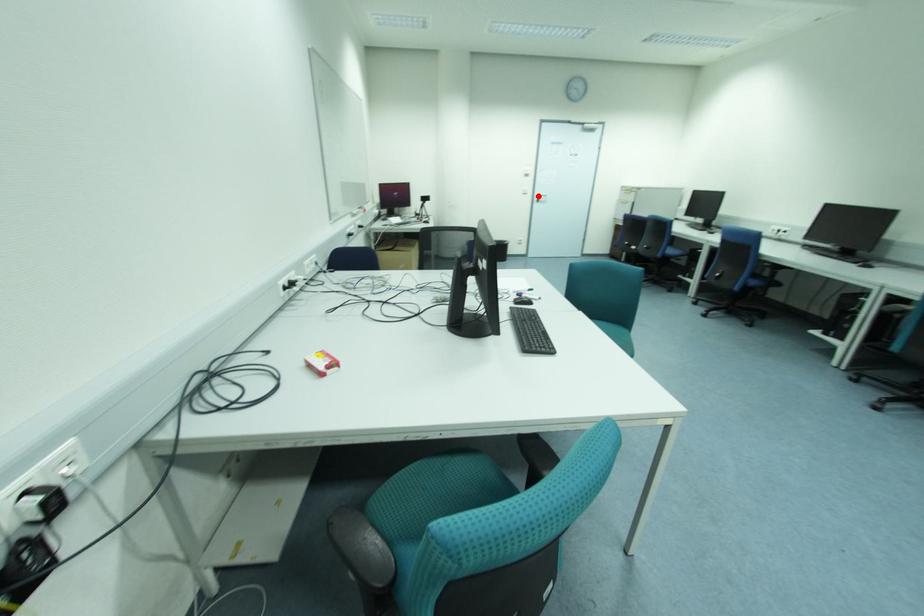
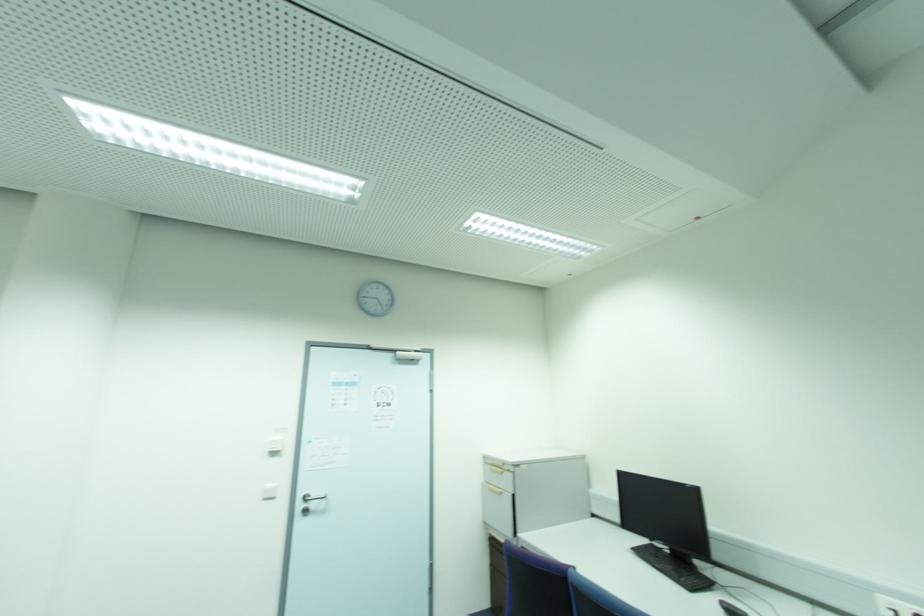
Locate, in the second image, the point that corresponds to the highlighted location in the first image.

(306, 500)